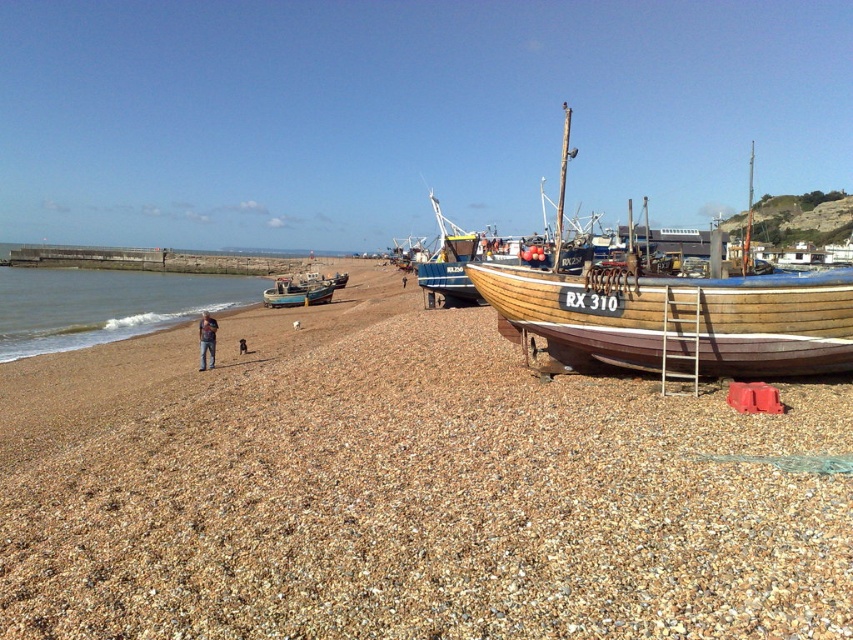
From the picture: You are a photographer standing at the edge of the beach, looking towards the boats. You notice two points marked in the scene. Which point is closer to your camera? The points are labeled as point 1 at coordinates (283, 276) and point 2 at coordinates (213, 321). Please answer based on their positions in the image.

Point 2 at coordinates (213, 321) is closer to the camera because it is positioned closer to the viewer compared to point 1 at (283, 276).